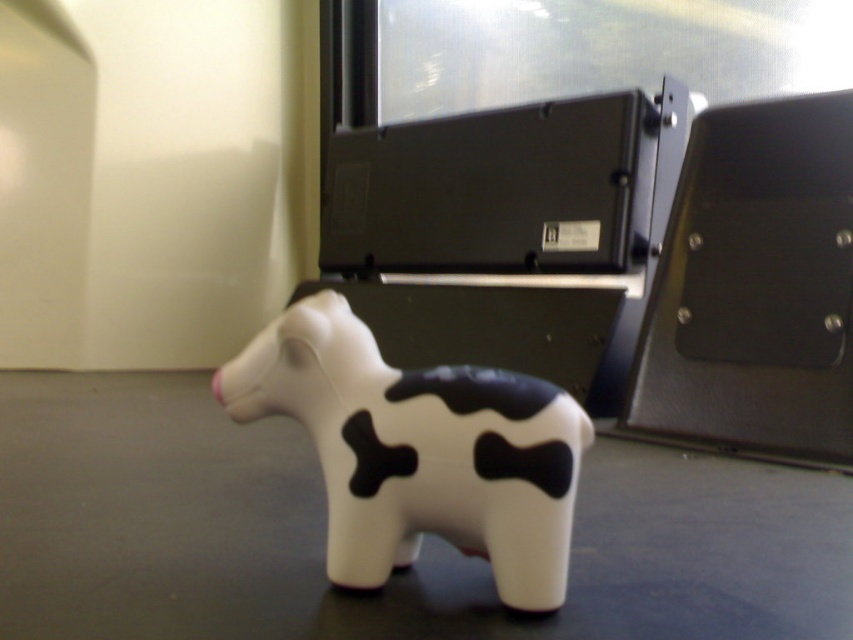
Can you confirm if metallic silver dot at center right is shorter than metallic dot at center right?

Indeed, metallic silver dot at center right has a lesser height compared to metallic dot at center right.

Which is below, metallic silver dot at center right or metallic dot at center right?

Positioned lower is metallic silver dot at center right.

Between point (830, 326) and point (689, 236), which one is positioned behind?

The point (689, 236) is behind.

You are a GUI agent. You are given a task and a screenshot of the screen. Output one action in this format:
    pyautogui.click(x=<x>, y=<y>)
    Task: Click on the metallic silver dot at center right
    
    Given the screenshot: What is the action you would take?
    pyautogui.click(x=833, y=323)

Does point (535, 547) come closer to viewer compared to point (689, 244)?

Yes, point (535, 547) is closer to viewer.

Can you confirm if white matte cow at lower center is positioned to the right of metallic dot at center right?

Incorrect, white matte cow at lower center is not on the right side of metallic dot at center right.

Identify the location of white matte cow at lower center. (419, 451).

Can you confirm if white matte cow at lower center is positioned to the left of metallic silver dot at center right?

Correct, you'll find white matte cow at lower center to the left of metallic silver dot at center right.

Is point (422, 509) in front of point (833, 323)?

Yes, it is.

This screenshot has height=640, width=853. I want to click on white matte cow at lower center, so click(x=419, y=451).